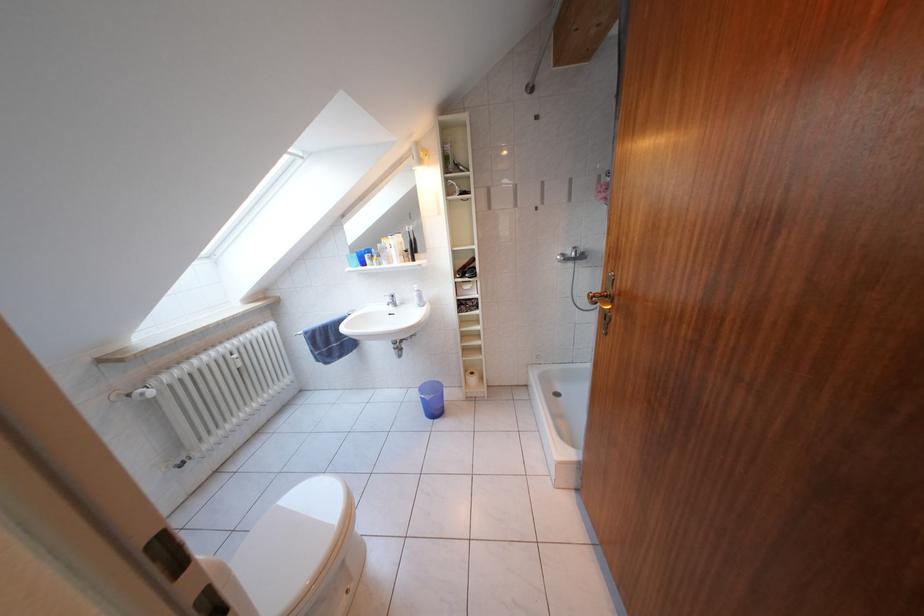
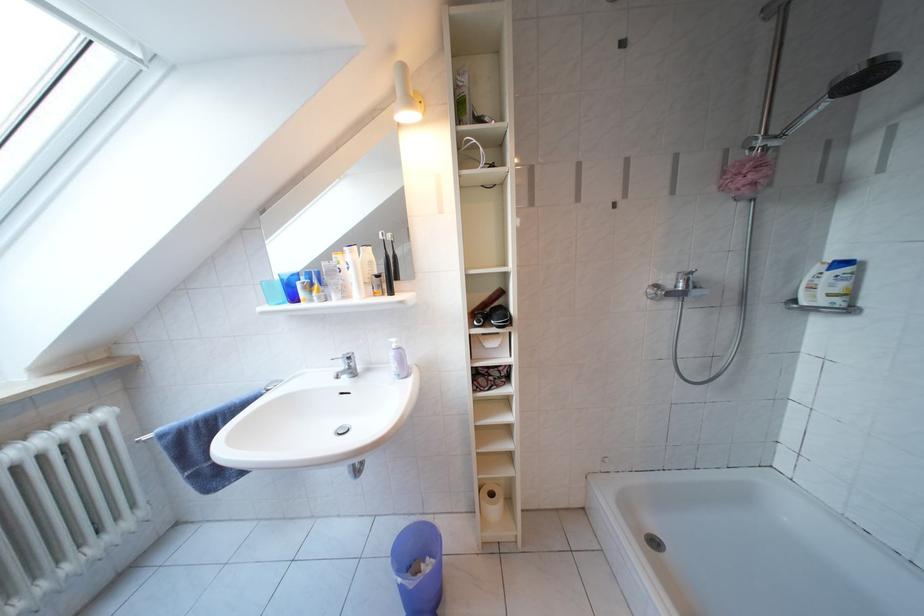
Question: I am providing you with two images of the same scene from different viewpoints. Please identify which objects are invisible in image2.

Choices:
 (A) black toothbrush
 (B) toilet paper roll
 (C) blue drinking cup
 (D) none of these

Answer: (D)